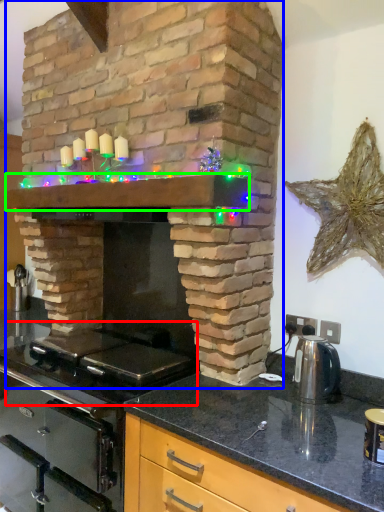
Question: Which object is positioned closest to gas stove (highlighted by a red box)? Select from fireplace (highlighted by a blue box) and mantle (highlighted by a green box).

Choices:
 (A) fireplace
 (B) mantle

Answer: (A)